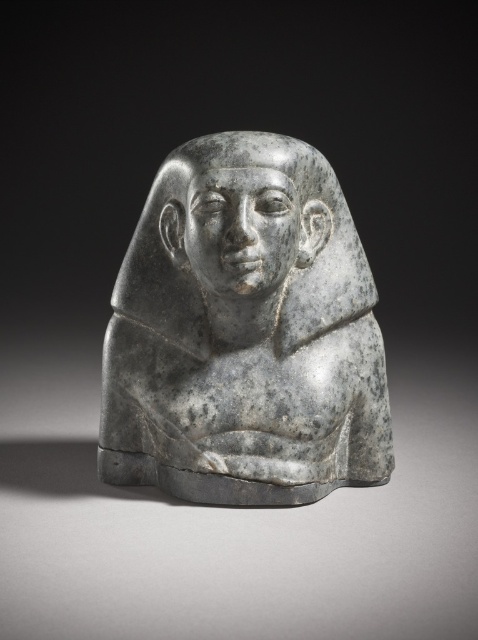
Question: Is gray stone bust at center thinner than gray stone head at center?

Choices:
 (A) no
 (B) yes

Answer: (A)

Question: Which object appears closest to the camera in this image?

Choices:
 (A) gray stone head at center
 (B) gray stone bust at center

Answer: (B)

Question: Among these points, which one is nearest to the camera?

Choices:
 (A) (212, 376)
 (B) (142, 262)

Answer: (A)

Question: Does gray stone bust at center have a lesser width compared to gray stone head at center?

Choices:
 (A) yes
 (B) no

Answer: (B)

Question: Is gray stone bust at center bigger than gray stone head at center?

Choices:
 (A) no
 (B) yes

Answer: (B)

Question: Which point appears closest to the camera in this image?

Choices:
 (A) (341, 260)
 (B) (355, 364)

Answer: (B)